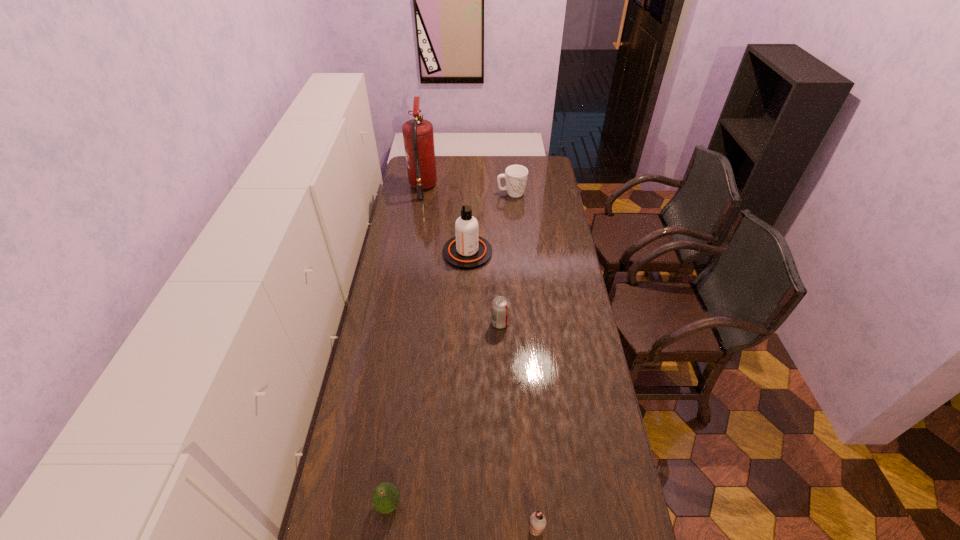
This screenshot has height=540, width=960. I want to click on fire extinguisher, so click(418, 136).

The width and height of the screenshot is (960, 540). Identify the location of the third farthest object. (467, 250).

Locate an element on the screen. cleansing agent is located at coordinates (467, 250).

Where is `mug`? mug is located at coordinates (516, 176).

At what (x,y) coordinates should I click in order to perform the action: click on soda can. Please return your answer as a coordinate pair (x, y). Image resolution: width=960 pixels, height=540 pixels. Looking at the image, I should click on (500, 307).

Identify the location of the nearest object. Image resolution: width=960 pixels, height=540 pixels. (537, 523).

In order to click on avocado in this screenshot , I will do `click(385, 498)`.

Where is `free spot located 0.300m at the front of the tallest object where the nozzle is aimed`? This screenshot has width=960, height=540. free spot located 0.300m at the front of the tallest object where the nozzle is aimed is located at coordinates (492, 187).

Find the location of a particular element. The width and height of the screenshot is (960, 540). free space located on the left of the cleansing agent is located at coordinates coord(401,253).

Identify the location of vacant space located on the side of the mug with the handle. (560, 193).